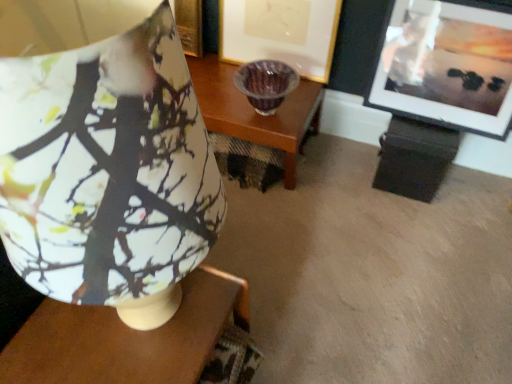
Question: Can you confirm if matte black picture frame at upper right, which is counted as the 1th picture frame, starting from the right, is positioned to the left of matte gold picture frame at center, which is counted as the 2th picture frame, starting from the right?

Choices:
 (A) yes
 (B) no

Answer: (B)

Question: Does matte black picture frame at upper right, which is counted as the 1th picture frame, starting from the right, lie in front of matte gold picture frame at center, which appears as the 1th picture frame when viewed from the left?

Choices:
 (A) no
 (B) yes

Answer: (B)

Question: Is matte black picture frame at upper right, which is counted as the 1th picture frame, starting from the right, wider than matte gold picture frame at center, which is counted as the 2th picture frame, starting from the right?

Choices:
 (A) no
 (B) yes

Answer: (B)

Question: From the image's perspective, is matte black picture frame at upper right, which is counted as the 1th picture frame, starting from the right, under matte gold picture frame at center, which appears as the 1th picture frame when viewed from the left?

Choices:
 (A) no
 (B) yes

Answer: (B)

Question: Are matte black picture frame at upper right, marked as the 2th picture frame in a left-to-right arrangement, and matte gold picture frame at center, which appears as the 1th picture frame when viewed from the left, far apart?

Choices:
 (A) yes
 (B) no

Answer: (B)

Question: From the image's perspective, is matte wood table at center located above or below matte gold picture frame at center, which is counted as the 2th picture frame, starting from the right?

Choices:
 (A) above
 (B) below

Answer: (B)

Question: From a real-world perspective, is matte wood table at center physically located above or below matte gold picture frame at center, which appears as the 1th picture frame when viewed from the left?

Choices:
 (A) below
 (B) above

Answer: (A)

Question: Is matte wood table at center spatially inside matte gold picture frame at center, which appears as the 1th picture frame when viewed from the left, or outside of it?

Choices:
 (A) outside
 (B) inside

Answer: (A)

Question: Considering the positions of point click(38, 337) and point click(318, 61), is point click(38, 337) closer or farther from the camera than point click(318, 61)?

Choices:
 (A) farther
 (B) closer

Answer: (B)

Question: From their relative heights in the image, would you say matte wood table at center is taller or shorter than matte ceramic lampshade at upper left?

Choices:
 (A) tall
 (B) short

Answer: (B)

Question: Would you say matte wood table at center is to the left or to the right of matte ceramic lampshade at upper left in the picture?

Choices:
 (A) right
 (B) left

Answer: (B)

Question: Is point (156, 329) closer or farther from the camera than point (1, 13)?

Choices:
 (A) farther
 (B) closer

Answer: (A)

Question: Considering their positions, is matte wood table at center located in front of or behind matte ceramic lampshade at upper left?

Choices:
 (A) behind
 (B) front

Answer: (A)

Question: Is matte ceramic lampshade at upper left bigger or smaller than matte wood table at center?

Choices:
 (A) small
 (B) big

Answer: (B)

Question: In the image, is matte ceramic lampshade at upper left on the left side or the right side of matte wood table at center?

Choices:
 (A) right
 (B) left

Answer: (A)